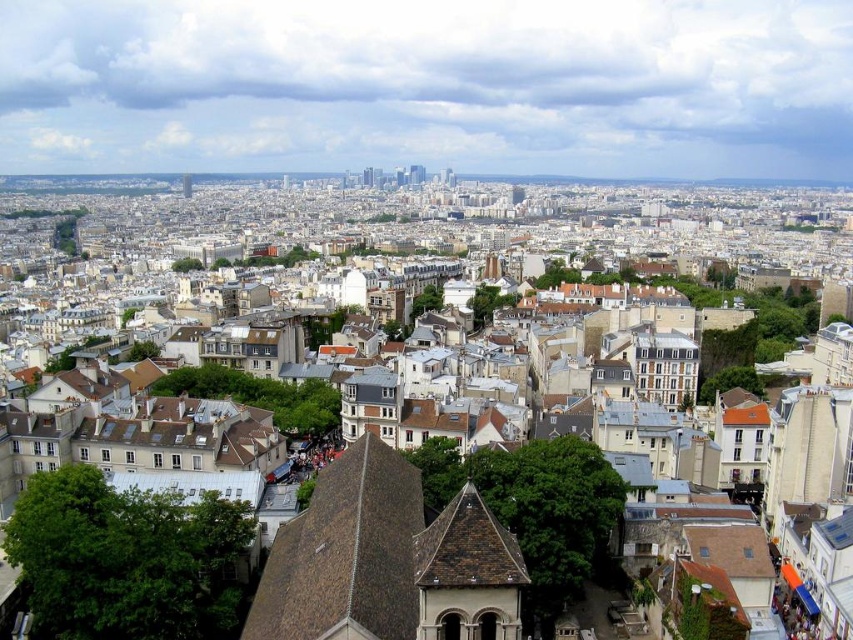
Between brown tile roof at center and smooth concrete tower at upper center, which one has more height?

smooth concrete tower at upper center is taller.

Image resolution: width=853 pixels, height=640 pixels. What do you see at coordinates (467, 573) in the screenshot?
I see `brown tile roof at center` at bounding box center [467, 573].

Find the location of a particular element. This screenshot has height=640, width=853. brown tile roof at center is located at coordinates (467, 573).

Is point (306, 227) farther from camera compared to point (184, 195)?

No, it is not.

Is point (439, 182) positioned before point (190, 195)?

Yes, point (439, 182) is in front of point (190, 195).

Is point (724, 365) positioned in front of point (189, 179)?

Yes, it is.

Locate an element on the screen. brown tiled roofs at center is located at coordinates (421, 240).

Which is more to the left, brown tiled roofs at center or brown tile roof at center?

From the viewer's perspective, brown tiled roofs at center appears more on the left side.

Does brown tiled roofs at center have a lesser height compared to brown tile roof at center?

Incorrect, brown tiled roofs at center's height does not fall short of brown tile roof at center's.

Between point (292, 256) and point (479, 625), which one is positioned in front?

Point (479, 625) is more forward.

The width and height of the screenshot is (853, 640). Identify the location of brown tiled roofs at center. (421, 240).